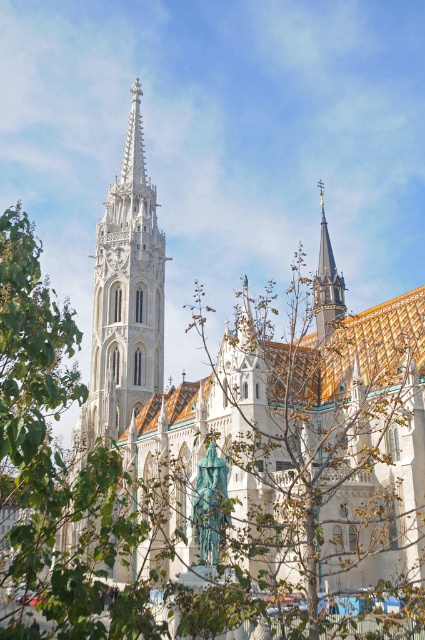
You are standing in front of the white stone church at center. If you want to take a photo that includes the entire structure without any cropping, what should you consider about the camera distance?

The white stone church at center is 40.53 meters away from the camera. To capture the entire structure in one photo without cropping, ensure the camera is positioned at least 40.53 meters away to accommodate the church size within the frame.

You are standing in front of the Gothic church and want to take a photo of the white stone tower at center and the shiny gold spire at upper right. Which object should you point your camera towards first to capture both in the frame?

You should point your camera towards the shiny gold spire at upper right first because the white stone tower at center is positioned under it, meaning the tower will naturally be included in the frame when focusing on the spire.

You are an architect visiting the church and want to compare the two prominent structures in the image. Which one is bigger in size between the white stone tower at center and the shiny gold spire at upper right?

The white stone tower at center has a larger size compared to the shiny gold spire at upper right, so the white stone tower at center is bigger in size.